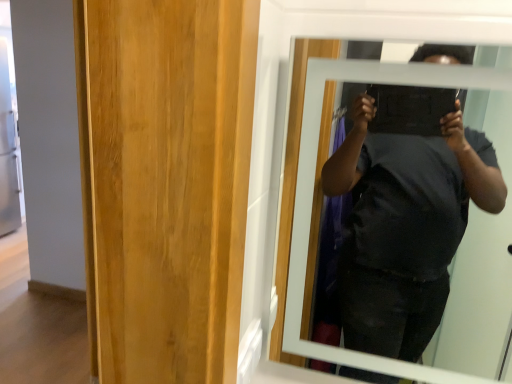
This screenshot has width=512, height=384. What do you see at coordinates (311, 204) in the screenshot?
I see `matte black mirror at center` at bounding box center [311, 204].

Measure the distance between point (353, 63) and camera.

A distance of 25.55 inches exists between point (353, 63) and camera.

Locate an element on the screen. The width and height of the screenshot is (512, 384). matte black mirror at center is located at coordinates (311, 204).

The image size is (512, 384). I want to click on matte black mirror at center, so click(x=311, y=204).